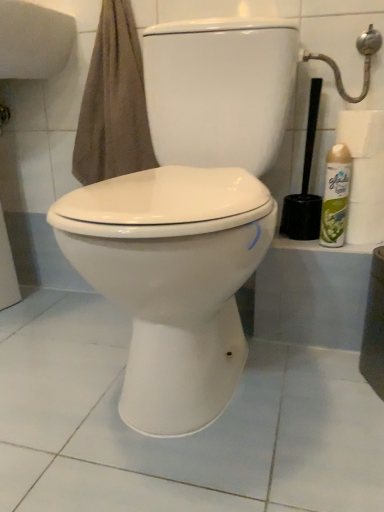
I want to click on vacant space situated on the left part of white glossy toilet at center, so click(52, 359).